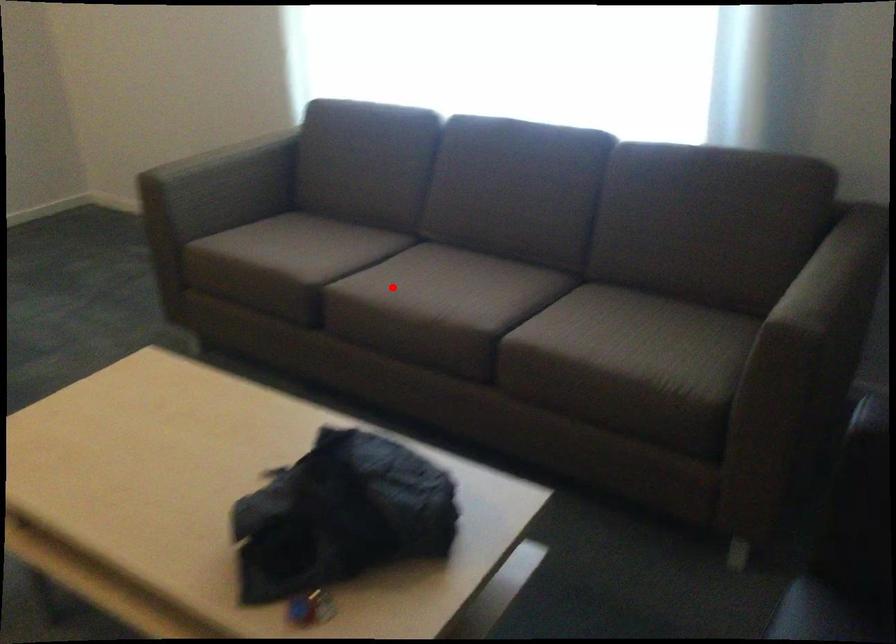
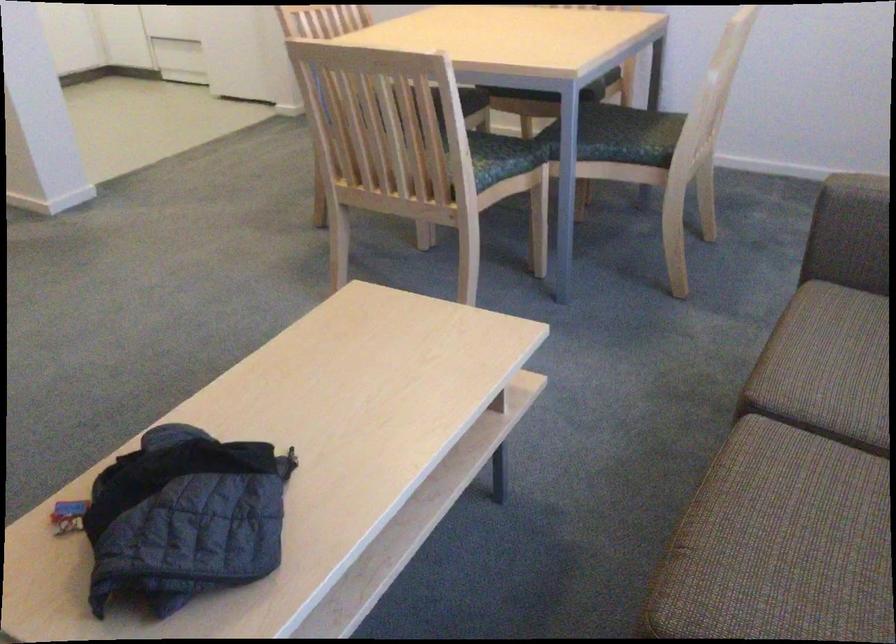
The point at the highlighted location is marked in the first image. Where is the corresponding point in the second image?

(794, 489)